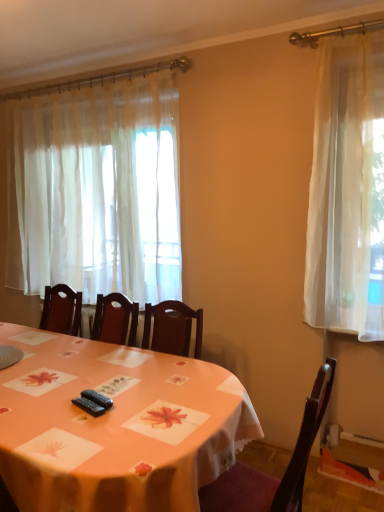
Question: Considering the relative sizes of wooden chair at center and orange fabric table at center in the image provided, is wooden chair at center shorter than orange fabric table at center?

Choices:
 (A) no
 (B) yes

Answer: (A)

Question: From the image's perspective, would you say wooden chair at center is shown under orange fabric table at center?

Choices:
 (A) no
 (B) yes

Answer: (A)

Question: Does wooden chair at center have a greater width compared to orange fabric table at center?

Choices:
 (A) yes
 (B) no

Answer: (B)

Question: Considering the relative positions of wooden chair at center and orange fabric table at center in the image provided, is wooden chair at center to the right of orange fabric table at center from the viewer's perspective?

Choices:
 (A) no
 (B) yes

Answer: (B)

Question: Is wooden chair at center far from orange fabric table at center?

Choices:
 (A) no
 (B) yes

Answer: (A)

Question: Is wooden chair at center smaller than orange fabric table at center?

Choices:
 (A) no
 (B) yes

Answer: (B)

Question: Is orange fabric table at center outside sheer white curtain at left?

Choices:
 (A) no
 (B) yes

Answer: (B)

Question: Is orange fabric table at center positioned in front of sheer white curtain at left?

Choices:
 (A) yes
 (B) no

Answer: (A)

Question: Is orange fabric table at center further to the viewer compared to sheer white curtain at left?

Choices:
 (A) yes
 (B) no

Answer: (B)

Question: Is orange fabric table at center bigger than sheer white curtain at left?

Choices:
 (A) no
 (B) yes

Answer: (B)

Question: Does orange fabric table at center touch sheer white curtain at left?

Choices:
 (A) yes
 (B) no

Answer: (B)

Question: Does orange fabric table at center have a greater width compared to sheer white curtain at left?

Choices:
 (A) no
 (B) yes

Answer: (B)

Question: Is sheer white curtain at left bigger than wooden chair at center?

Choices:
 (A) no
 (B) yes

Answer: (B)